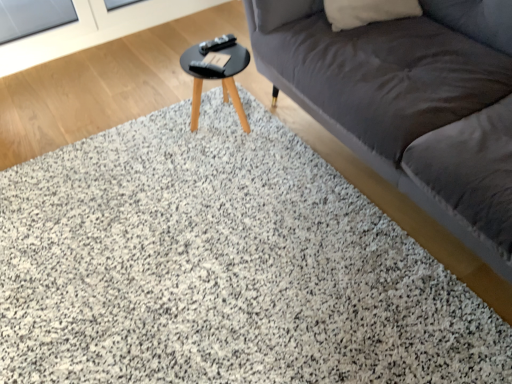
At what (x,y) coordinates should I click in order to perform the action: click on free space in front of black glossy table at center. Please return your answer as a coordinate pair (x, y). The height and width of the screenshot is (384, 512). Looking at the image, I should click on (215, 163).